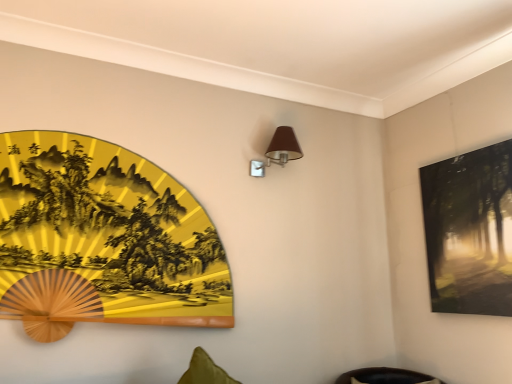
Question: Considering the relative positions of gold lacquered fan at left, the 2th picture frame from the right, and brown fabric table lamp at upper center in the image provided, is gold lacquered fan at left, the 2th picture frame from the right, to the left of brown fabric table lamp at upper center from the viewer's perspective?

Choices:
 (A) no
 (B) yes

Answer: (B)

Question: From a real-world perspective, is gold lacquered fan at left, the 1th picture frame from the left, under brown fabric table lamp at upper center?

Choices:
 (A) yes
 (B) no

Answer: (A)

Question: From the image's perspective, is gold lacquered fan at left, the 2th picture frame from the right, under brown fabric table lamp at upper center?

Choices:
 (A) no
 (B) yes

Answer: (B)

Question: From a real-world perspective, is gold lacquered fan at left, the 1th picture frame from the left, on top of brown fabric table lamp at upper center?

Choices:
 (A) no
 (B) yes

Answer: (A)

Question: Is gold lacquered fan at left, the 2th picture frame from the right, positioned with its back to brown fabric table lamp at upper center?

Choices:
 (A) no
 (B) yes

Answer: (A)

Question: Is brown fabric table lamp at upper center inside the boundaries of gold lacquered fan at left, the 1th picture frame from the left, or outside?

Choices:
 (A) outside
 (B) inside

Answer: (A)

Question: Considering the positions of brown fabric table lamp at upper center and gold lacquered fan at left, the 1th picture frame from the left, in the image, is brown fabric table lamp at upper center taller or shorter than gold lacquered fan at left, the 1th picture frame from the left,?

Choices:
 (A) tall
 (B) short

Answer: (B)

Question: Considering their positions, is brown fabric table lamp at upper center located in front of or behind gold lacquered fan at left, the 2th picture frame from the right?

Choices:
 (A) front
 (B) behind

Answer: (B)

Question: Visually, is brown fabric table lamp at upper center positioned to the left or to the right of gold lacquered fan at left, the 2th picture frame from the right?

Choices:
 (A) right
 (B) left

Answer: (A)

Question: Would you say gold lacquered fan at left, the 1th picture frame from the left, is to the left or to the right of brown fabric table lamp at upper center in the picture?

Choices:
 (A) right
 (B) left

Answer: (B)

Question: Considering their positions, is gold lacquered fan at left, the 2th picture frame from the right, located in front of or behind brown fabric table lamp at upper center?

Choices:
 (A) front
 (B) behind

Answer: (A)

Question: From the image's perspective, is gold lacquered fan at left, the 2th picture frame from the right, located above or below brown fabric table lamp at upper center?

Choices:
 (A) above
 (B) below

Answer: (B)

Question: Considering the positions of gold lacquered fan at left, the 2th picture frame from the right, and brown fabric table lamp at upper center in the image, is gold lacquered fan at left, the 2th picture frame from the right, taller or shorter than brown fabric table lamp at upper center?

Choices:
 (A) tall
 (B) short

Answer: (A)

Question: Looking at their shapes, would you say brown fabric table lamp at upper center is wider or thinner than matte black painting at upper right, which is the first picture frame from right to left?

Choices:
 (A) wide
 (B) thin

Answer: (A)

Question: Is brown fabric table lamp at upper center to the left or to the right of matte black painting at upper right, which is the first picture frame from right to left, in the image?

Choices:
 (A) right
 (B) left

Answer: (B)